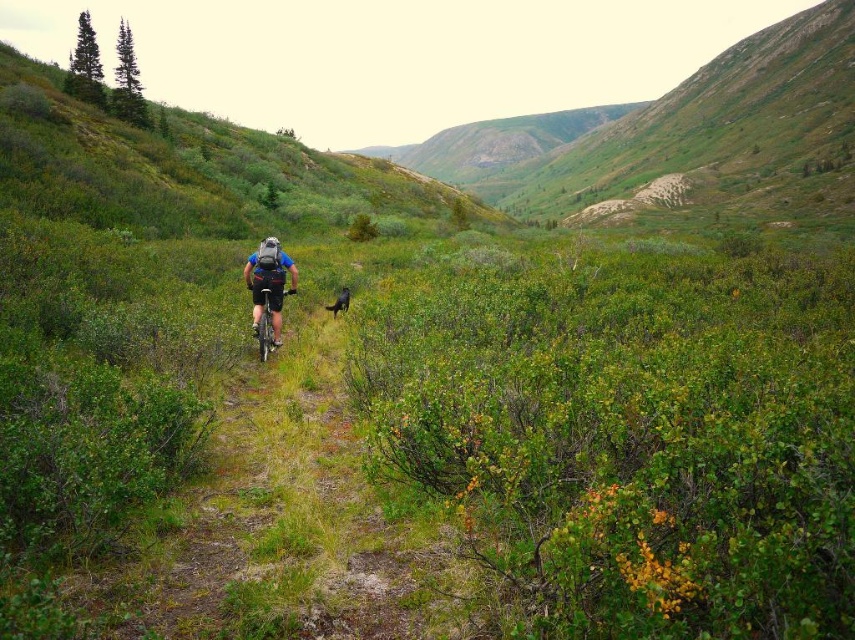
Question: Which of the following is the farthest from the observer?

Choices:
 (A) (281, 269)
 (B) (263, 326)

Answer: (B)

Question: Does shiny metallic bicycle at center appear on the right side of shiny black dog at center?

Choices:
 (A) yes
 (B) no

Answer: (B)

Question: In this image, where is blue matte bicycle at center located relative to shiny metallic bicycle at center?

Choices:
 (A) left
 (B) right

Answer: (B)

Question: Does shiny metallic bicycle at center have a greater width compared to shiny black dog at center?

Choices:
 (A) no
 (B) yes

Answer: (B)

Question: Which point appears farthest from the camera in this image?

Choices:
 (A) (261, 316)
 (B) (276, 269)
 (C) (327, 307)

Answer: (C)

Question: Which point appears closest to the camera in this image?

Choices:
 (A) (251, 282)
 (B) (343, 292)
 (C) (287, 289)

Answer: (A)